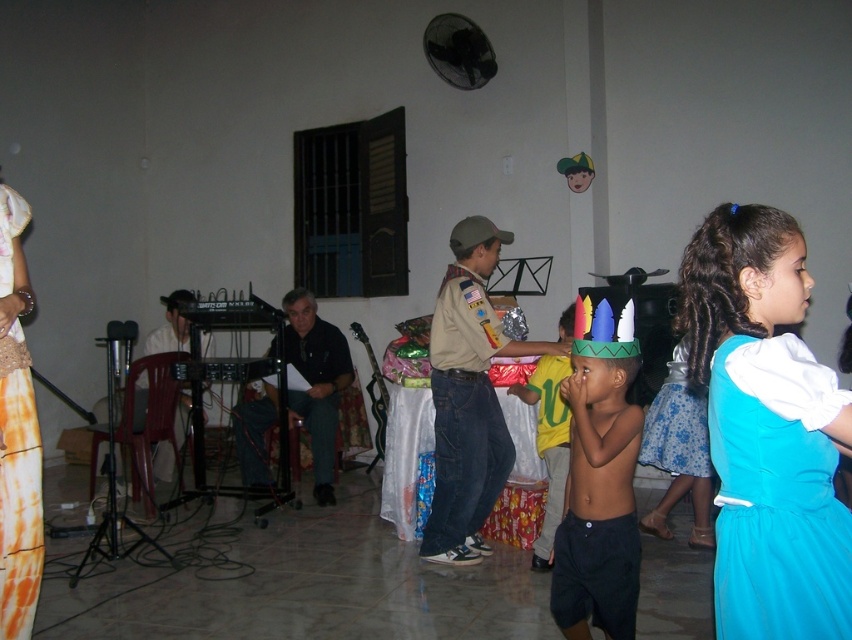
Question: Can you confirm if multicolored paper crown at center is smaller than blue satin dress at lower right?

Choices:
 (A) no
 (B) yes

Answer: (A)

Question: Which of the following is the farthest from the observer?

Choices:
 (A) multicolored paper crown at center
 (B) turquoise satin dress at right
 (C) yellow fabric shirt at center
 (D) blue satin dress at lower right

Answer: (D)

Question: Does turquoise satin dress at right have a lesser width compared to yellow fabric shirt at center?

Choices:
 (A) yes
 (B) no

Answer: (A)

Question: Which of the following is the closest to the observer?

Choices:
 (A) blue satin dress at lower right
 (B) turquoise satin dress at right
 (C) yellow fabric shirt at center
 (D) multicolored paper crown at center

Answer: (B)

Question: Is turquoise satin dress at right to the right of blue satin dress at lower right from the viewer's perspective?

Choices:
 (A) yes
 (B) no

Answer: (B)

Question: Among these points, which one is farthest from the camera?

Choices:
 (A) (616, 337)
 (B) (695, 435)
 (C) (1, 368)
 (D) (645, 579)

Answer: (B)